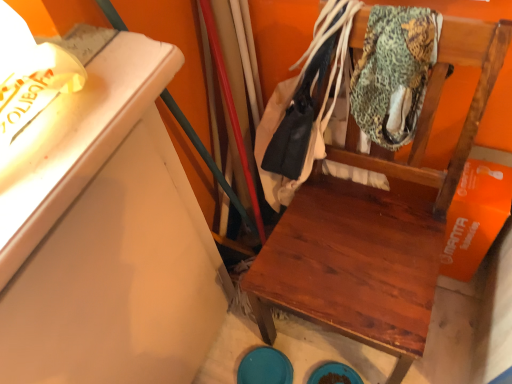
Question: Is wooden chair at center in contact with textured green fabric at upper right?

Choices:
 (A) no
 (B) yes

Answer: (A)

Question: From a real-world perspective, is wooden chair at center below textured green fabric at upper right?

Choices:
 (A) no
 (B) yes

Answer: (B)

Question: Can you confirm if wooden chair at center is wider than textured green fabric at upper right?

Choices:
 (A) yes
 (B) no

Answer: (A)

Question: Is wooden chair at center looking in the opposite direction of textured green fabric at upper right?

Choices:
 (A) no
 (B) yes

Answer: (B)

Question: Does wooden chair at center have a lesser height compared to textured green fabric at upper right?

Choices:
 (A) no
 (B) yes

Answer: (A)

Question: Does wooden chair at center have a smaller size compared to textured green fabric at upper right?

Choices:
 (A) no
 (B) yes

Answer: (A)

Question: Does leather jacket at center have a smaller size compared to textured green fabric at upper right?

Choices:
 (A) yes
 (B) no

Answer: (B)

Question: Is leather jacket at center next to textured green fabric at upper right?

Choices:
 (A) yes
 (B) no

Answer: (B)

Question: Is leather jacket at center taller than textured green fabric at upper right?

Choices:
 (A) yes
 (B) no

Answer: (A)

Question: Considering the relative positions of leather jacket at center and textured green fabric at upper right in the image provided, is leather jacket at center to the left of textured green fabric at upper right from the viewer's perspective?

Choices:
 (A) yes
 (B) no

Answer: (A)

Question: Could you tell me if leather jacket at center is facing textured green fabric at upper right?

Choices:
 (A) no
 (B) yes

Answer: (A)

Question: Can you confirm if leather jacket at center is shorter than textured green fabric at upper right?

Choices:
 (A) yes
 (B) no

Answer: (B)

Question: Considering the relative sizes of wooden chair at center and leather jacket at center in the image provided, is wooden chair at center shorter than leather jacket at center?

Choices:
 (A) no
 (B) yes

Answer: (A)